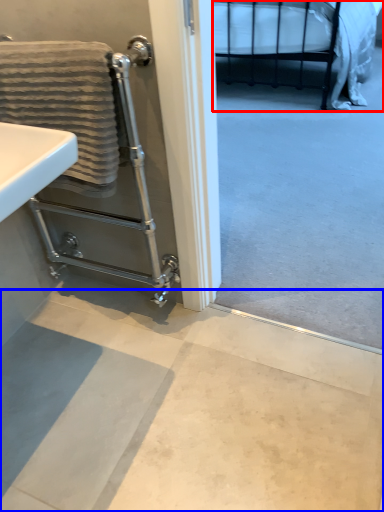
Question: Which point is further to the camera, bed (highlighted by a red box) or concrete (highlighted by a blue box)?

Choices:
 (A) bed
 (B) concrete

Answer: (A)